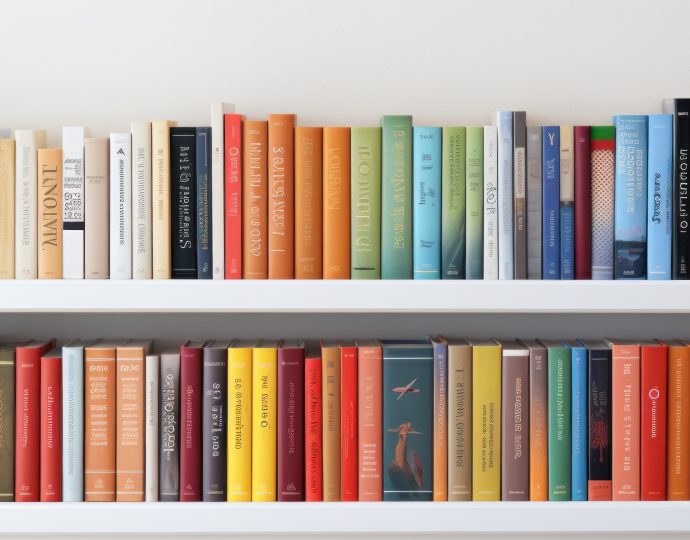
Find the location of a particular element. This screenshot has width=690, height=540. orange books is located at coordinates (50, 213), (233, 219), (256, 214), (277, 212), (306, 211), (337, 210), (680, 426), (542, 451), (130, 455), (107, 451).